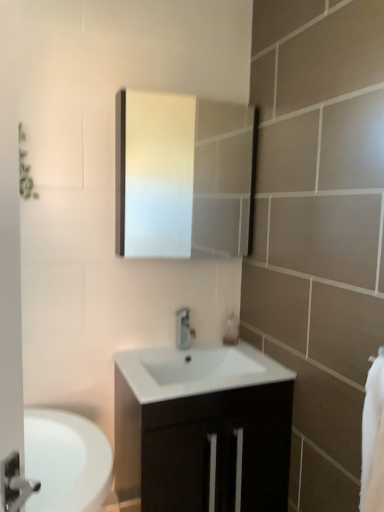
You are a GUI agent. You are given a task and a screenshot of the screen. Output one action in this format:
    pyautogui.click(x=<x>, y=<y>)
    Task: Click on the vacant space underneath white glossy medicine cabinet at upper center (from a real-world perspective)
    The height and width of the screenshot is (512, 384).
    Given the screenshot: What is the action you would take?
    pyautogui.click(x=160, y=350)